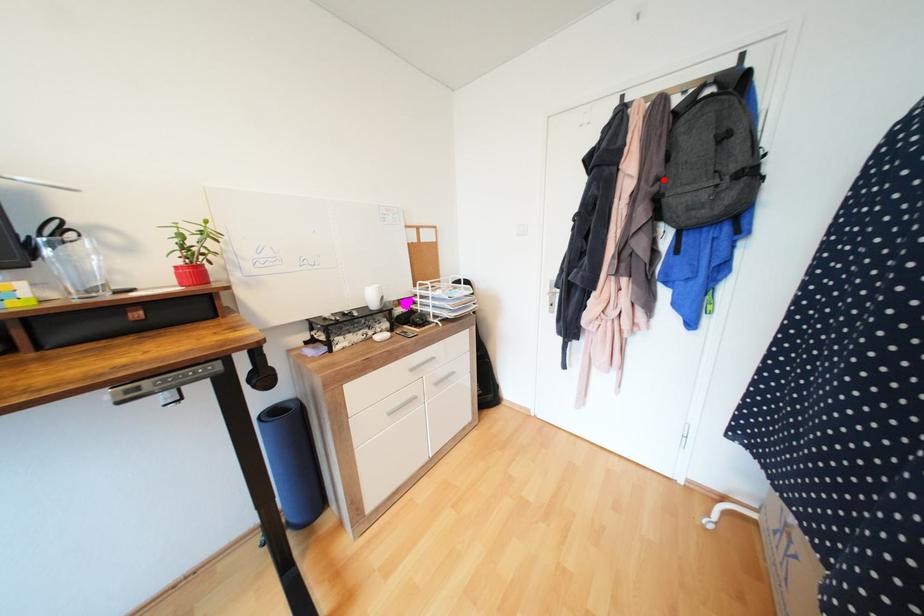
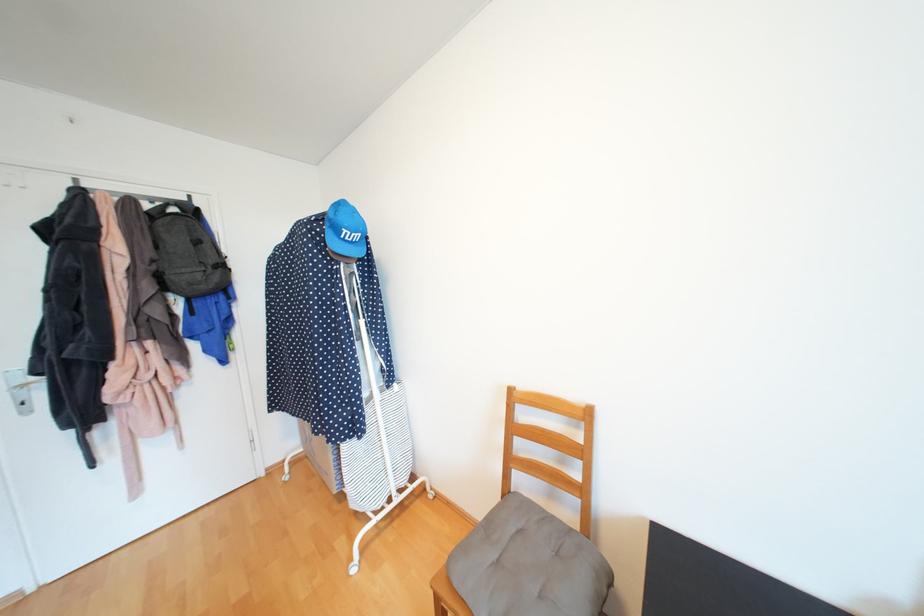
The point at the highlighted location is marked in the first image. Where is the corresponding point in the second image?

(160, 262)